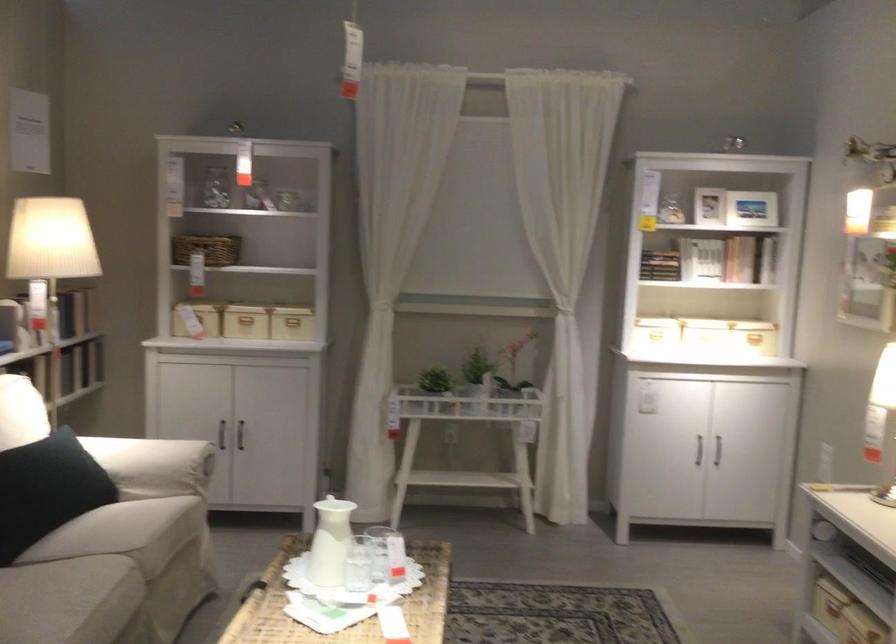
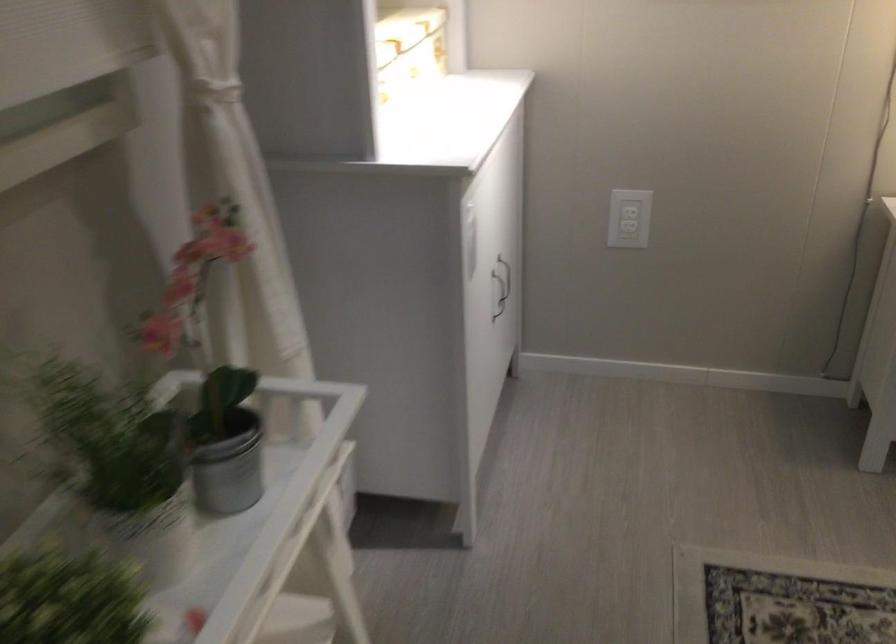
Where in the second image is the point corresponding to point (760, 442) from the first image?

(505, 277)